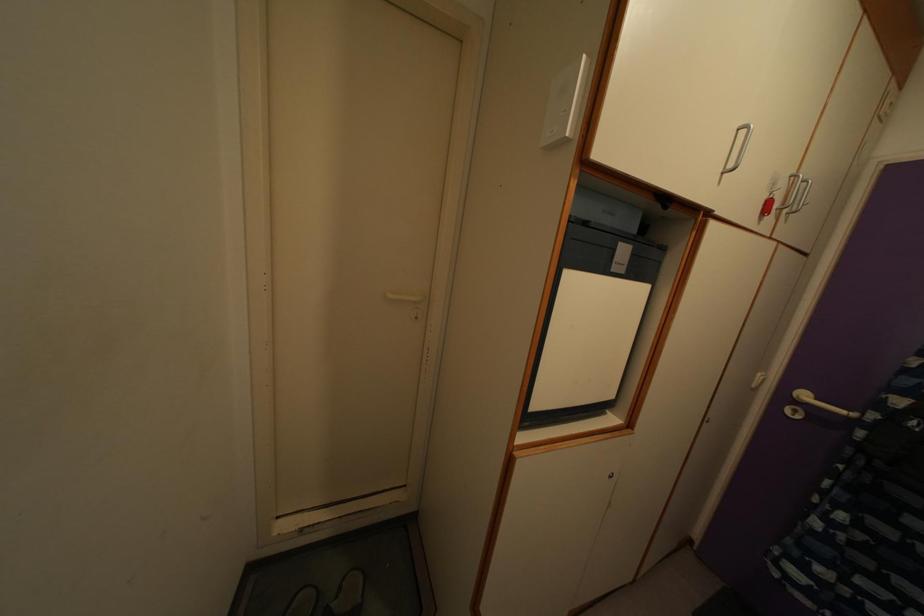
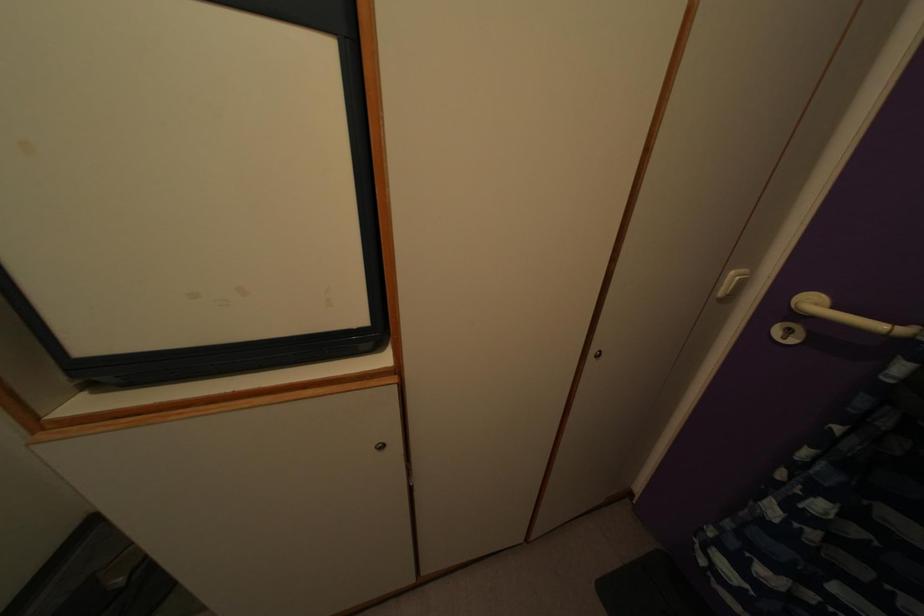
Where in the second image is the point corresponding to (807,403) from the first image?

(815, 310)